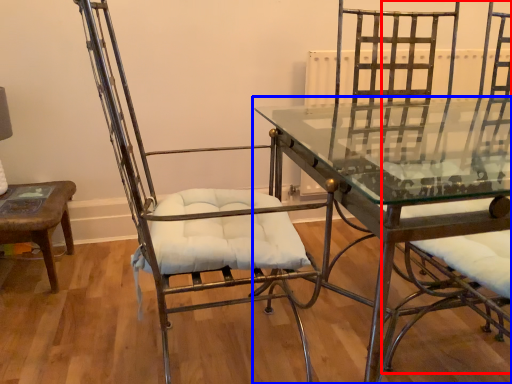
Question: Which object is closer to the camera taking this photo, swivel chair (highlighted by a red box) or table (highlighted by a blue box)?

Choices:
 (A) swivel chair
 (B) table

Answer: (A)